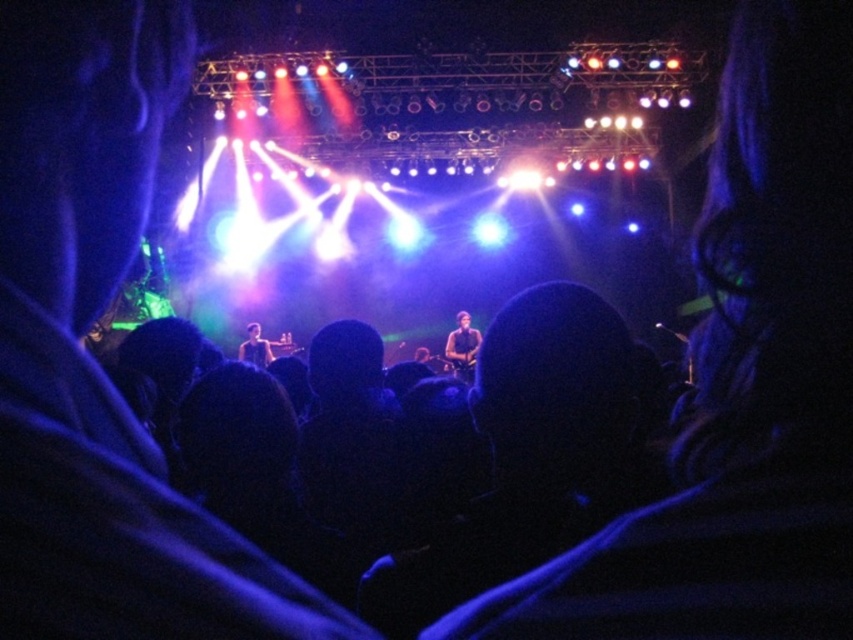
Question: Which point is closer to the camera?

Choices:
 (A) smooth skin face at center
 (B) shiny black guitar at center

Answer: (B)

Question: Is shiny black guitar at center positioned at the back of smooth skin face at center?

Choices:
 (A) yes
 (B) no

Answer: (B)

Question: Which of the following is the closest to the observer?

Choices:
 (A) smooth skin face at center
 (B) shiny black guitar at center

Answer: (B)

Question: Does shiny black guitar at center come behind smooth skin face at center?

Choices:
 (A) yes
 (B) no

Answer: (B)

Question: Which point appears farthest from the camera in this image?

Choices:
 (A) (456, 346)
 (B) (268, 349)

Answer: (B)

Question: Is shiny black guitar at center above smooth skin face at center?

Choices:
 (A) no
 (B) yes

Answer: (B)